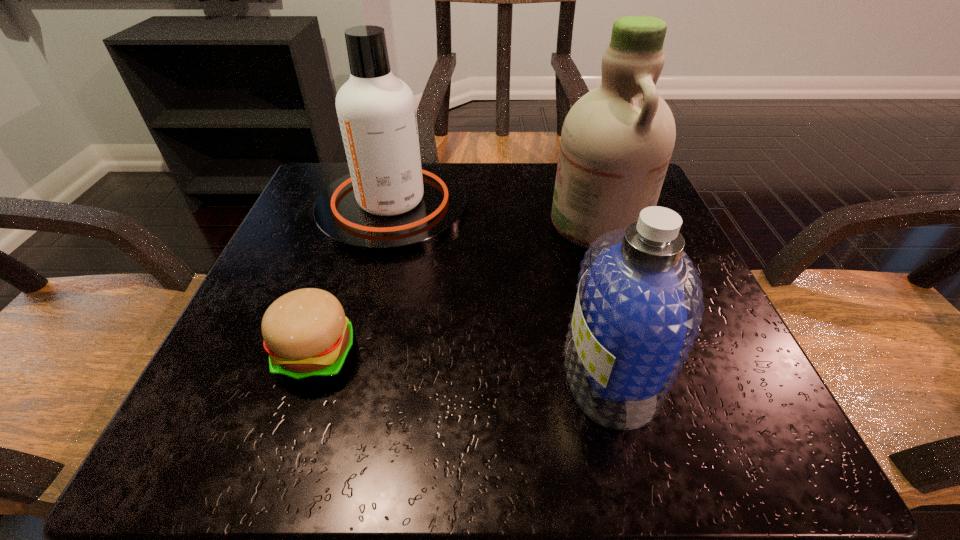
This screenshot has width=960, height=540. In order to click on the leftmost cleansing agent in this screenshot , I will do `click(389, 204)`.

Identify the location of the shortest cleansing agent. (638, 308).

Identify the location of the third tallest object. Image resolution: width=960 pixels, height=540 pixels. (638, 308).

Locate an element on the screen. Image resolution: width=960 pixels, height=540 pixels. the shortest object is located at coordinates (306, 333).

I want to click on vacant space located 0.180m on the right of the leftmost cleansing agent, so click(555, 209).

The height and width of the screenshot is (540, 960). I want to click on vacant space located on the back of the third tallest object, so click(584, 273).

The height and width of the screenshot is (540, 960). Find the location of `vacant region located on the right of the hamburger`. vacant region located on the right of the hamburger is located at coordinates (390, 354).

Locate an element on the screen. object that is at the near edge is located at coordinates (638, 308).

Where is `cleansing agent that is at the left edge`? The image size is (960, 540). cleansing agent that is at the left edge is located at coordinates (389, 204).

Where is `hamburger located in the left edge section of the desktop`? hamburger located in the left edge section of the desktop is located at coordinates (306, 333).